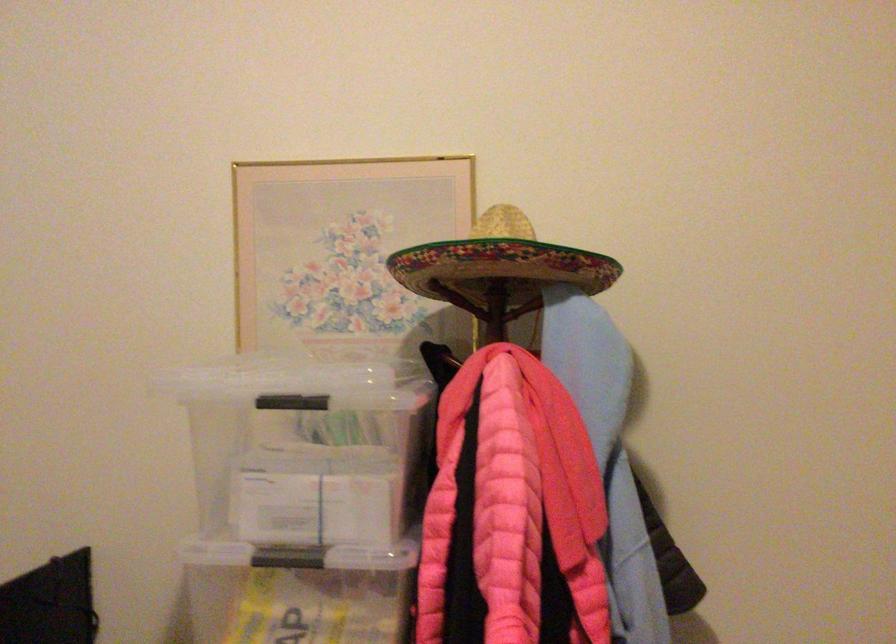
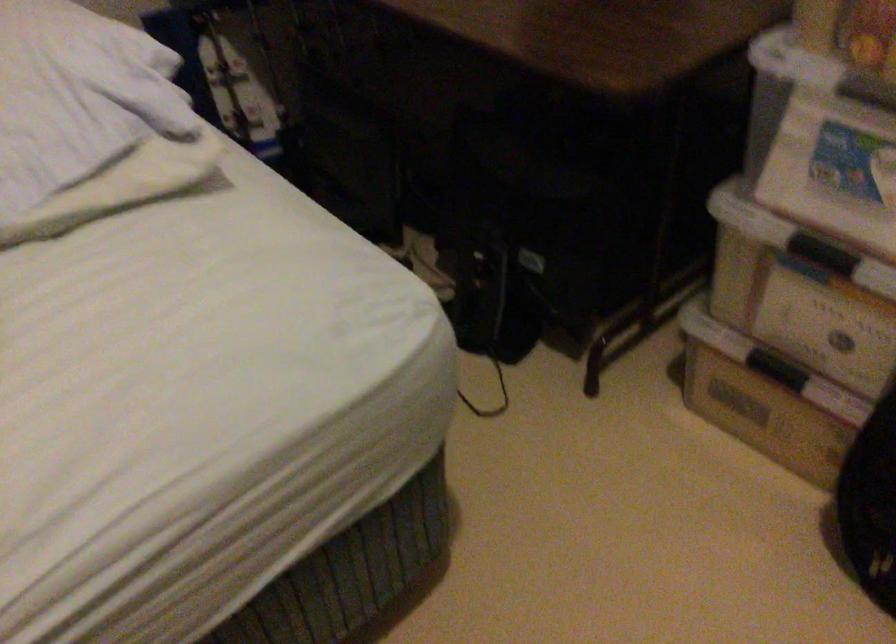
The first image is from the beginning of the video and the second image is from the end. How did the camera likely rotate when shooting the video?

The rotation direction of the camera is left-down.